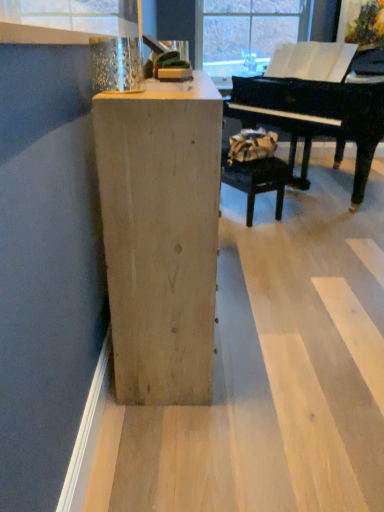
I want to click on free space in front of natural wood cabinet at center, so click(x=241, y=420).